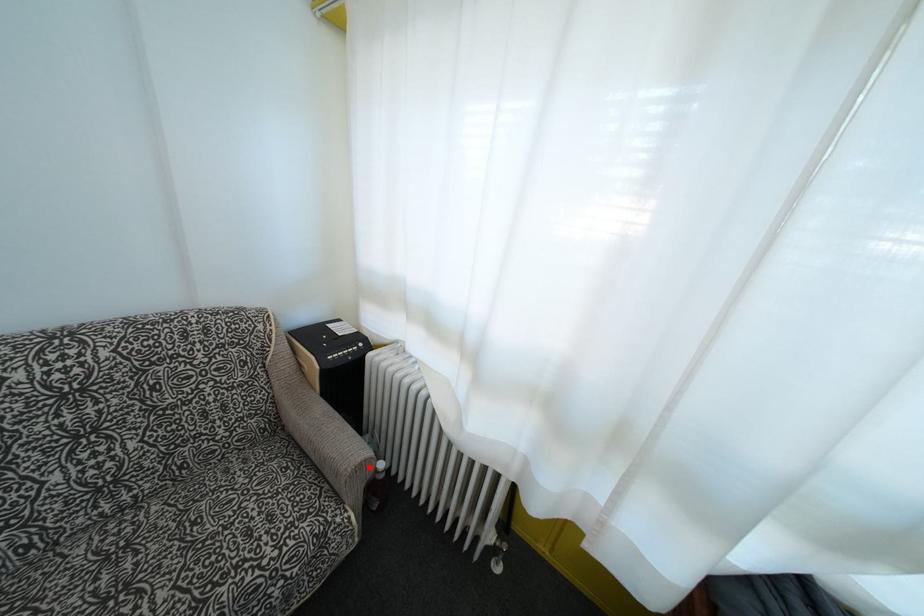
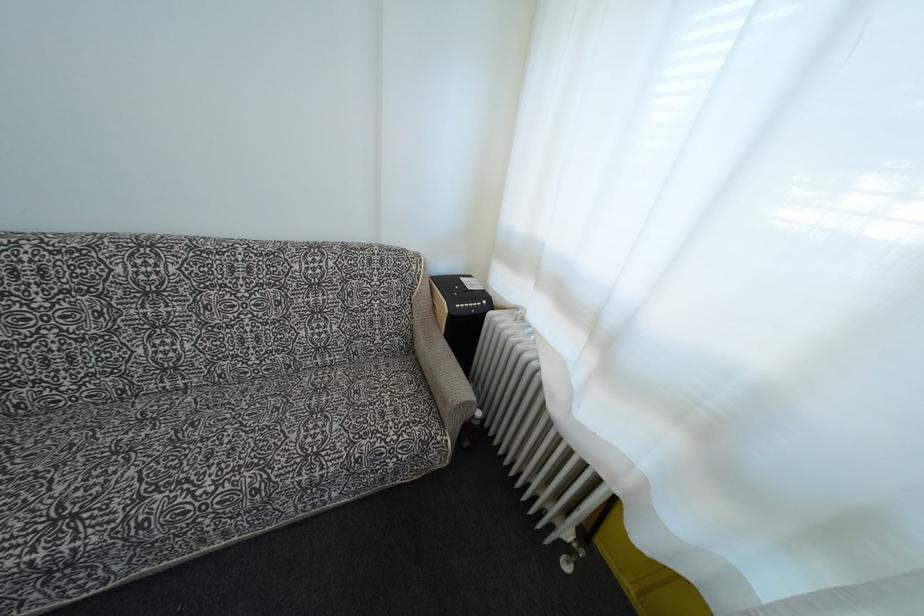
In the second image, find the point that corresponds to the highlighted location in the first image.

(472, 408)